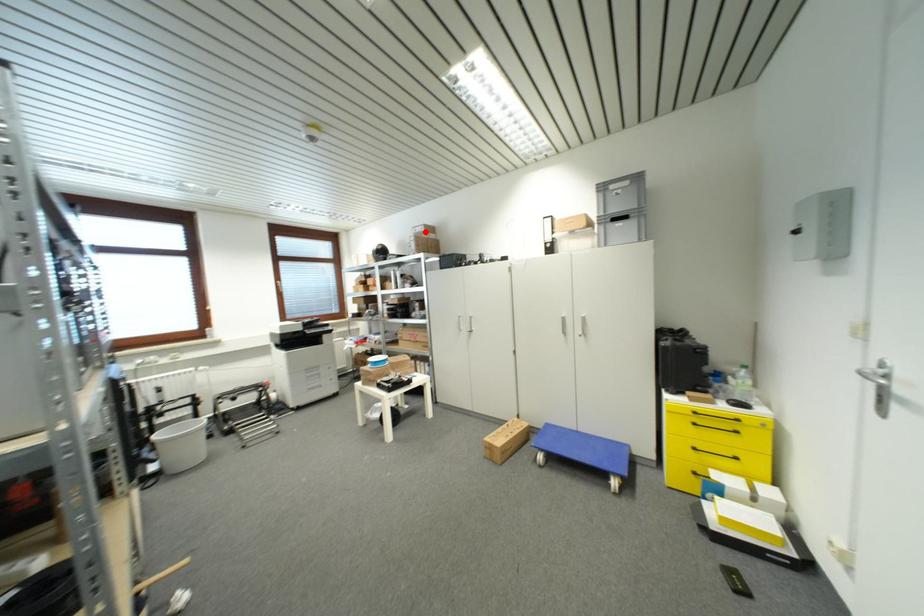
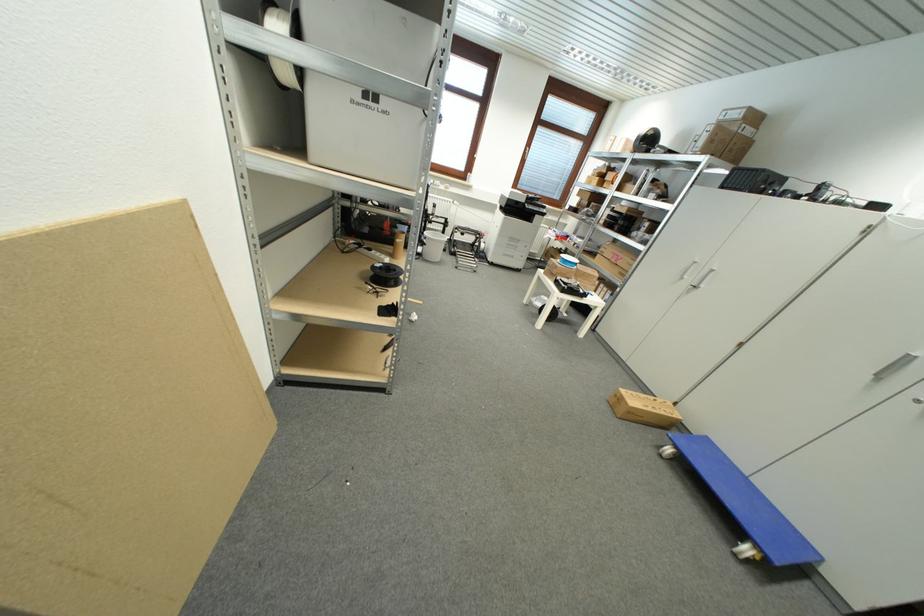
Find the pixel in the second image that matches the highlighted location in the first image.

(742, 116)